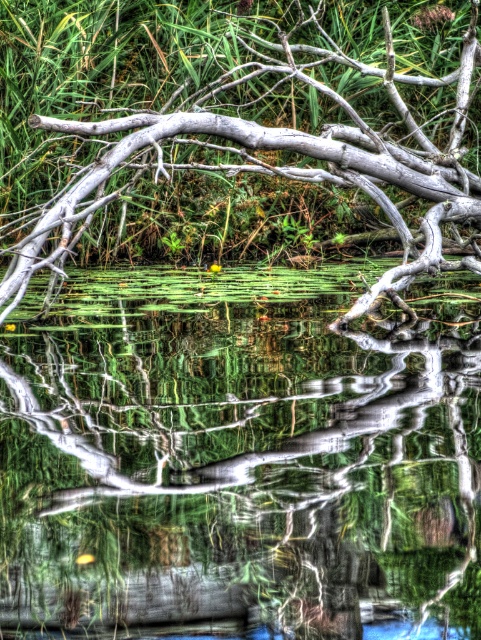
Question: Can you confirm if transparent water at center is bigger than gray wood tree branch at upper center?

Choices:
 (A) yes
 (B) no

Answer: (A)

Question: In this image, where is transparent water at center located relative to gray wood tree branch at upper center?

Choices:
 (A) above
 (B) below

Answer: (B)

Question: Which of the following is the farthest from the observer?

Choices:
 (A) (401, 428)
 (B) (26, 172)

Answer: (B)

Question: Can you confirm if transparent water at center is positioned below gray wood tree branch at upper center?

Choices:
 (A) yes
 (B) no

Answer: (A)

Question: Which of the following is the farthest from the observer?

Choices:
 (A) (153, 189)
 (B) (8, 406)

Answer: (A)